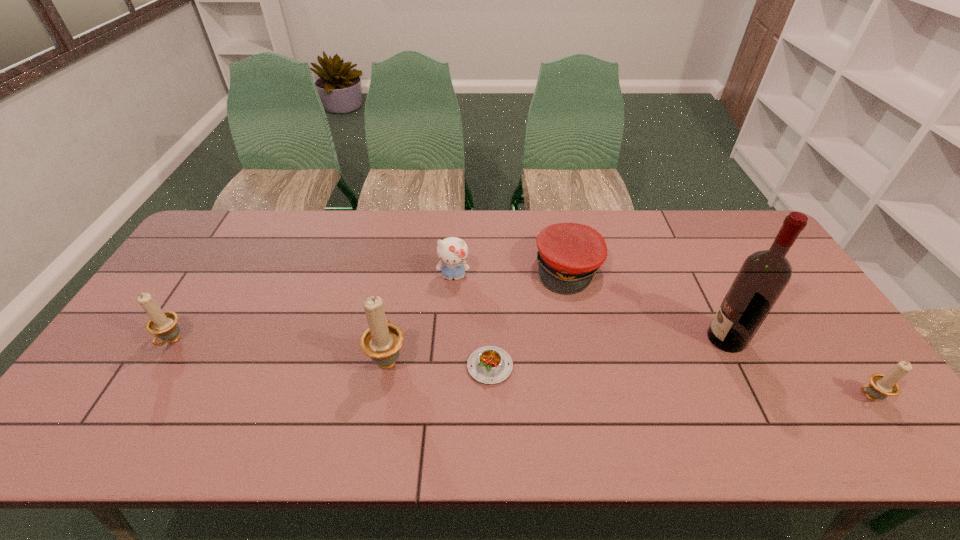
Where is `the second shortest candle_holder`? the second shortest candle_holder is located at coordinates (162, 324).

The height and width of the screenshot is (540, 960). I want to click on the leftmost object, so click(x=162, y=324).

At what (x,y) coordinates should I click in order to perform the action: click on the second candle_holder from right to left. Please return your answer as a coordinate pair (x, y). This screenshot has width=960, height=540. Looking at the image, I should click on (382, 340).

Locate an element on the screen. The height and width of the screenshot is (540, 960). the tallest candle_holder is located at coordinates (382, 340).

Image resolution: width=960 pixels, height=540 pixels. Find the location of `the shortest candle_holder`. the shortest candle_holder is located at coordinates (881, 386).

In order to click on the rightmost object in this screenshot , I will do `click(881, 386)`.

Find the location of a particular element. kitten is located at coordinates (452, 251).

I want to click on the sixth tallest object, so click(569, 255).

Where is `cap`? The image size is (960, 540). cap is located at coordinates (569, 255).

Identify the location of the sixth object from left to right. (764, 275).